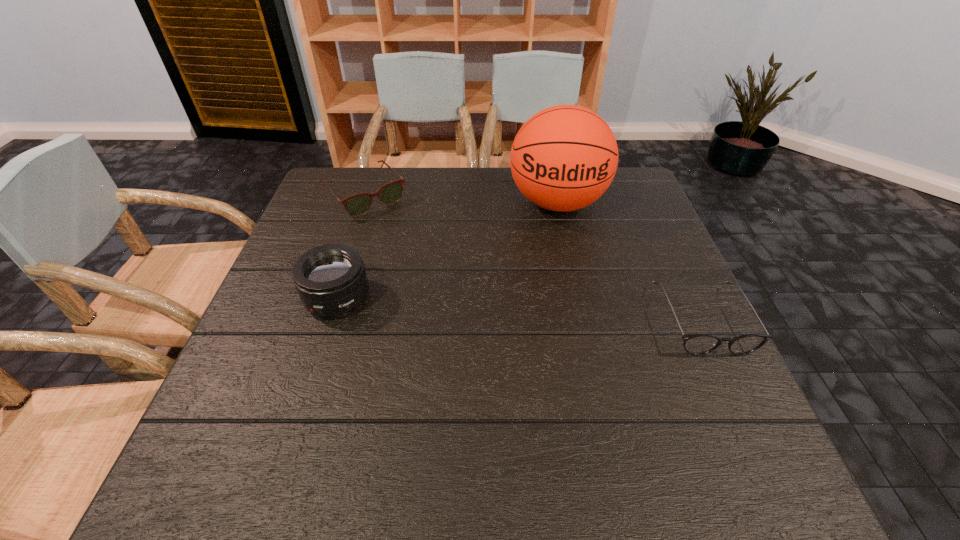
The width and height of the screenshot is (960, 540). I want to click on object positioned at the far left corner, so click(358, 204).

I want to click on object that is positioned at the far right corner, so click(563, 158).

The width and height of the screenshot is (960, 540). In the image, there is a desktop. What are the coordinates of `vacant space at the far edge` in the screenshot? It's located at (492, 206).

Locate an element on the screen. The height and width of the screenshot is (540, 960). vacant space at the left edge is located at coordinates (317, 235).

Image resolution: width=960 pixels, height=540 pixels. What are the coordinates of `free space at the right edge` in the screenshot? It's located at (664, 235).

The height and width of the screenshot is (540, 960). In the image, there is a desktop. Identify the location of vacant space at the far left corner. (332, 210).

In order to click on unoccupied position between the basketball and the right spectacles in this screenshot , I will do `click(630, 261)`.

The height and width of the screenshot is (540, 960). In order to click on blank region between the rightmost object and the tallest object in this screenshot , I will do `click(630, 261)`.

You are a GUI agent. You are given a task and a screenshot of the screen. Output one action in this format:
    pyautogui.click(x=<x>, y=<y>)
    Task: Click on the empty space between the telephoto lens and the rightmost object
    Image resolution: width=960 pixels, height=540 pixels.
    Given the screenshot: What is the action you would take?
    pos(519,309)

I want to click on free space between the basketball and the telephoto lens, so click(447, 251).